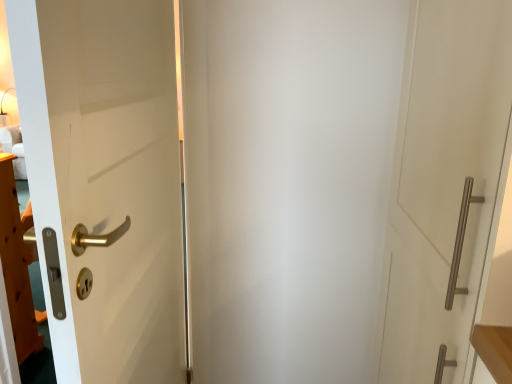
You are a GUI agent. You are given a task and a screenshot of the screen. Output one action in this format:
    pyautogui.click(x=<x>, y=<y>)
    Task: Click on the white matte door at left, acting as the second door starting from the right
    The image size is (512, 384).
    Given the screenshot: What is the action you would take?
    pyautogui.click(x=106, y=179)

What do you see at coordinates (106, 179) in the screenshot? I see `white matte door at left, acting as the second door starting from the right` at bounding box center [106, 179].

Measure the distance between white matte door at left, positioned as the 1th door in left-to-right order, and camera.

white matte door at left, positioned as the 1th door in left-to-right order, is 20.63 inches from camera.

The image size is (512, 384). I want to click on satin nickel handle at right, which is counted as the first door, starting from the right, so click(446, 185).

This screenshot has width=512, height=384. Describe the element at coordinates (446, 185) in the screenshot. I see `satin nickel handle at right, which is counted as the first door, starting from the right` at that location.

Identify the location of white matte door at left, acting as the second door starting from the right. The image size is (512, 384). (106, 179).

Which object is positioned more to the right, white matte door at left, positioned as the 1th door in left-to-right order, or satin nickel handle at right, the 2th door in the left-to-right sequence?

satin nickel handle at right, the 2th door in the left-to-right sequence.

Is white matte door at left, positioned as the 1th door in left-to-right order, further to the viewer compared to satin nickel handle at right, which is counted as the first door, starting from the right?

Yes, white matte door at left, positioned as the 1th door in left-to-right order, is behind satin nickel handle at right, which is counted as the first door, starting from the right.

Which is behind, point (173, 360) or point (383, 367)?

The point (383, 367) is more distant.

From the image's perspective, relative to satin nickel handle at right, which is counted as the first door, starting from the right, is white matte door at left, acting as the second door starting from the right, above or below?

Based on their image positions, white matte door at left, acting as the second door starting from the right, is located beneath satin nickel handle at right, which is counted as the first door, starting from the right.

From a real-world perspective, relative to satin nickel handle at right, the 2th door in the left-to-right sequence, is white matte door at left, acting as the second door starting from the right, vertically above or below?

white matte door at left, acting as the second door starting from the right, is below satin nickel handle at right, the 2th door in the left-to-right sequence.

Does white matte door at left, positioned as the 1th door in left-to-right order, have a lesser width compared to satin nickel handle at right, the 2th door in the left-to-right sequence?

Yes.

Considering the sizes of white matte door at left, acting as the second door starting from the right, and satin nickel handle at right, which is counted as the first door, starting from the right, in the image, is white matte door at left, acting as the second door starting from the right, taller or shorter than satin nickel handle at right, which is counted as the first door, starting from the right,?

In the image, white matte door at left, acting as the second door starting from the right, appears to be taller than satin nickel handle at right, which is counted as the first door, starting from the right.

Considering the sizes of objects white matte door at left, acting as the second door starting from the right, and satin nickel handle at right, which is counted as the first door, starting from the right, in the image provided, who is smaller, white matte door at left, acting as the second door starting from the right, or satin nickel handle at right, which is counted as the first door, starting from the right,?

white matte door at left, acting as the second door starting from the right.

Could satin nickel handle at right, which is counted as the first door, starting from the right, be considered to be inside white matte door at left, positioned as the 1th door in left-to-right order?

No, satin nickel handle at right, which is counted as the first door, starting from the right, is not a part of white matte door at left, positioned as the 1th door in left-to-right order.

Is white matte door at left, acting as the second door starting from the right, beside satin nickel handle at right, the 2th door in the left-to-right sequence?

white matte door at left, acting as the second door starting from the right, is not next to satin nickel handle at right, the 2th door in the left-to-right sequence, and they're not touching.

Is white matte door at left, acting as the second door starting from the right, facing towards satin nickel handle at right, which is counted as the first door, starting from the right?

Yes, white matte door at left, acting as the second door starting from the right, is facing satin nickel handle at right, which is counted as the first door, starting from the right.

What's the angular difference between white matte door at left, positioned as the 1th door in left-to-right order, and satin nickel handle at right, the 2th door in the left-to-right sequence,'s facing directions?

0.77 degrees separate the facing orientations of white matte door at left, positioned as the 1th door in left-to-right order, and satin nickel handle at right, the 2th door in the left-to-right sequence.

Where is `door lying above the white matte door at left, acting as the second door starting from the right (from the image's perspective)`? The width and height of the screenshot is (512, 384). door lying above the white matte door at left, acting as the second door starting from the right (from the image's perspective) is located at coordinates (446, 185).

Considering the relative positions of satin nickel handle at right, which is counted as the first door, starting from the right, and white matte door at left, positioned as the 1th door in left-to-right order, in the image provided, is satin nickel handle at right, which is counted as the first door, starting from the right, to the left of white matte door at left, positioned as the 1th door in left-to-right order, from the viewer's perspective?

No, satin nickel handle at right, which is counted as the first door, starting from the right, is not to the left of white matte door at left, positioned as the 1th door in left-to-right order.

Consider the image. Considering their positions, is satin nickel handle at right, which is counted as the first door, starting from the right, located in front of or behind white matte door at left, positioned as the 1th door in left-to-right order?

Clearly, satin nickel handle at right, which is counted as the first door, starting from the right, is in front of white matte door at left, positioned as the 1th door in left-to-right order.

Does point (434, 38) come closer to viewer compared to point (109, 25)?

That is False.

From the image's perspective, which one is positioned higher, satin nickel handle at right, which is counted as the first door, starting from the right, or white matte door at left, positioned as the 1th door in left-to-right order?

From the image's view, satin nickel handle at right, which is counted as the first door, starting from the right, is above.

From a real-world perspective, which object stands above the other?

satin nickel handle at right, the 2th door in the left-to-right sequence, from a real-world perspective.

Does satin nickel handle at right, the 2th door in the left-to-right sequence, have a lesser width compared to white matte door at left, positioned as the 1th door in left-to-right order?

No, satin nickel handle at right, the 2th door in the left-to-right sequence, is not thinner than white matte door at left, positioned as the 1th door in left-to-right order.

Does satin nickel handle at right, which is counted as the first door, starting from the right, have a greater height compared to white matte door at left, acting as the second door starting from the right?

No, satin nickel handle at right, which is counted as the first door, starting from the right, is not taller than white matte door at left, acting as the second door starting from the right.

Does satin nickel handle at right, which is counted as the first door, starting from the right, have a larger size compared to white matte door at left, positioned as the 1th door in left-to-right order?

Indeed, satin nickel handle at right, which is counted as the first door, starting from the right, has a larger size compared to white matte door at left, positioned as the 1th door in left-to-right order.

Choose the correct answer: Is satin nickel handle at right, which is counted as the first door, starting from the right, inside white matte door at left, acting as the second door starting from the right, or outside it?

satin nickel handle at right, which is counted as the first door, starting from the right, lies outside white matte door at left, acting as the second door starting from the right.

Is white matte door at left, positioned as the 1th door in left-to-right order, at the back of satin nickel handle at right, the 2th door in the left-to-right sequence?

Absolutely, satin nickel handle at right, the 2th door in the left-to-right sequence, is directed away from white matte door at left, positioned as the 1th door in left-to-right order.

The image size is (512, 384). I want to click on door to the left of satin nickel handle at right, which is counted as the first door, starting from the right, so click(106, 179).

Identify the location of door lying on the left of satin nickel handle at right, the 2th door in the left-to-right sequence. The height and width of the screenshot is (384, 512). click(106, 179).

Where is `door that is above the white matte door at left, positioned as the 1th door in left-to-right order (from a real-world perspective)`? door that is above the white matte door at left, positioned as the 1th door in left-to-right order (from a real-world perspective) is located at coordinates (446, 185).